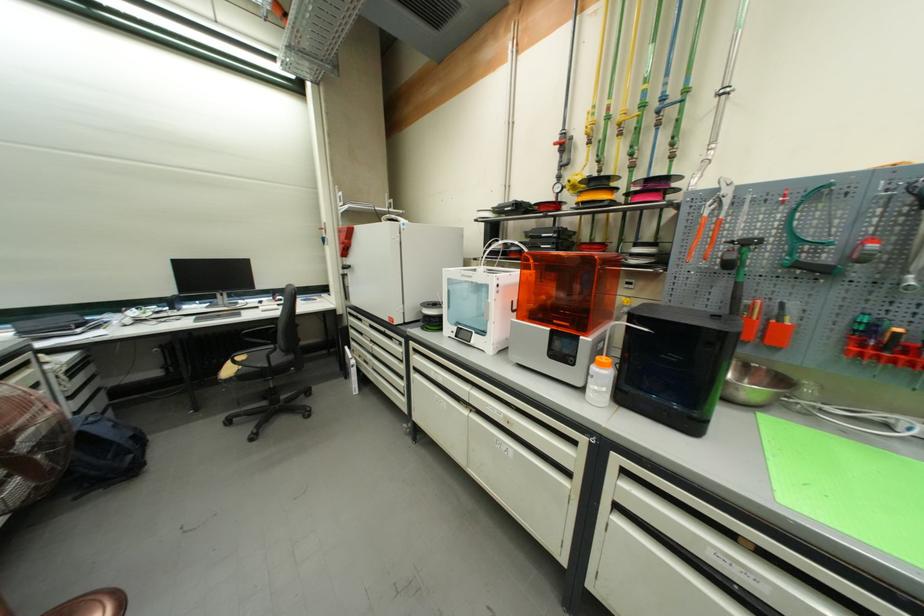
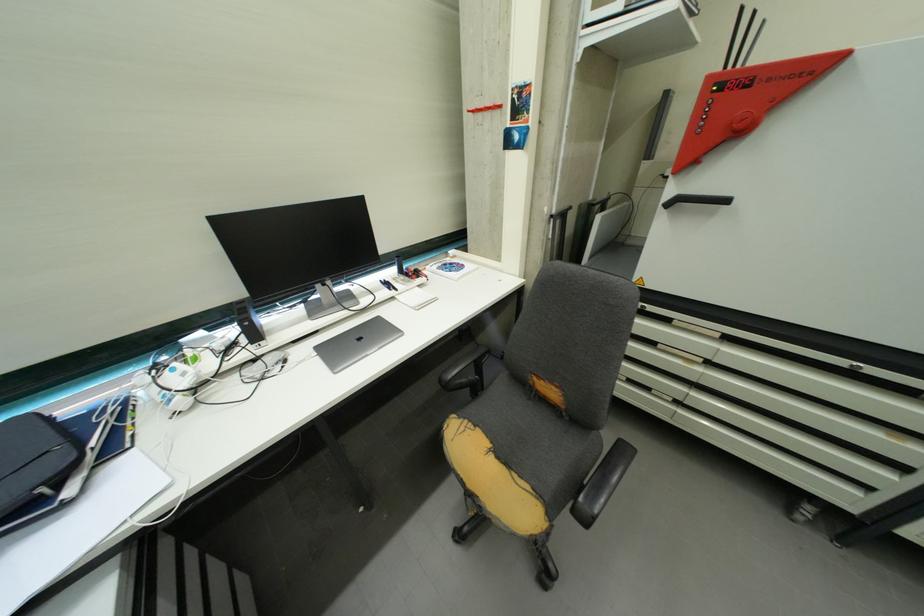
Find the pixel in the second image that matches point 140,315 in the first image.

(189, 376)